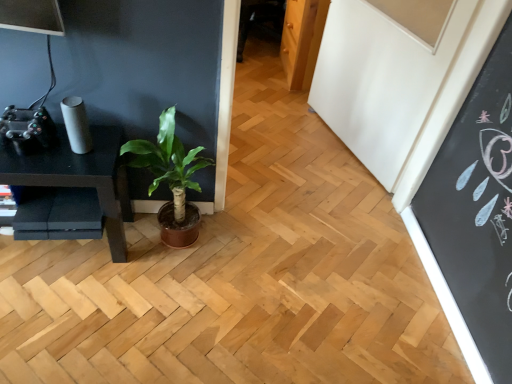
The image size is (512, 384). Find the location of `vacant space in front of black matte table at left`. vacant space in front of black matte table at left is located at coordinates (52, 317).